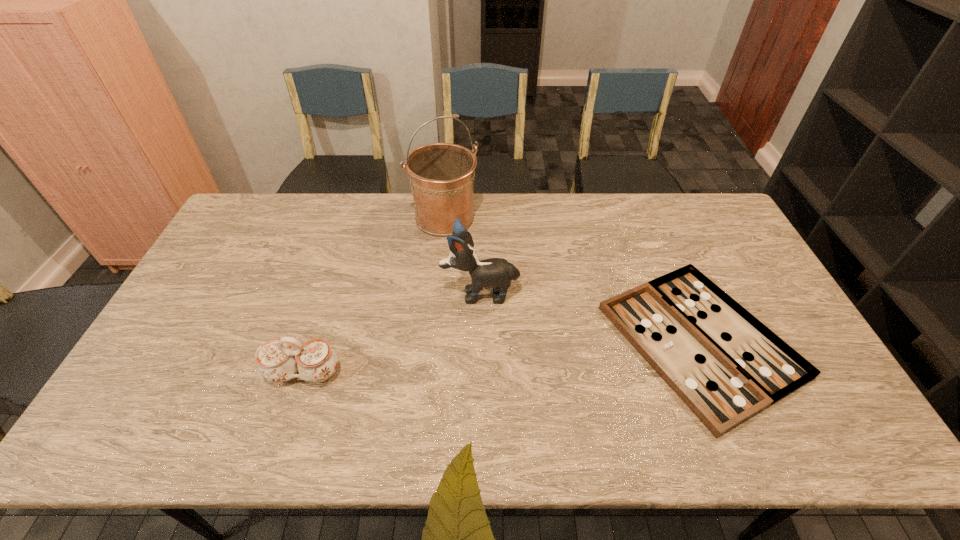
I want to click on the tallest object, so click(441, 175).

At what (x,y) coordinates should I click in order to perform the action: click on bucket. Please return your answer as a coordinate pair (x, y). Looking at the image, I should click on (441, 175).

Where is `the third shortest object`? the third shortest object is located at coordinates (498, 273).

Identify the location of chinaware. (277, 361).

You are a GUI agent. You are given a task and a screenshot of the screen. Output one action in this format:
    pyautogui.click(x=<x>, y=<y>)
    Task: Click on the second shortest object
    
    Given the screenshot: What is the action you would take?
    pyautogui.click(x=277, y=361)

Locate an element on the screen. the rightmost object is located at coordinates (726, 366).

This screenshot has height=540, width=960. What are the coordinates of `the shortest object` in the screenshot? It's located at (726, 366).

Identify the location of vacant position located on the front of the bucket. (436, 316).

Locate an element on the screen. free space located 0.080m on the front-facing side of the puppy is located at coordinates [x=415, y=293].

You are a GUI agent. You are given a task and a screenshot of the screen. Output one action in this format:
    pyautogui.click(x=<x>, y=<y>)
    Task: Click on the vacant region located 0.160m on the front-facing side of the puppy
    This screenshot has width=960, height=540.
    Given the screenshot: What is the action you would take?
    pyautogui.click(x=389, y=293)